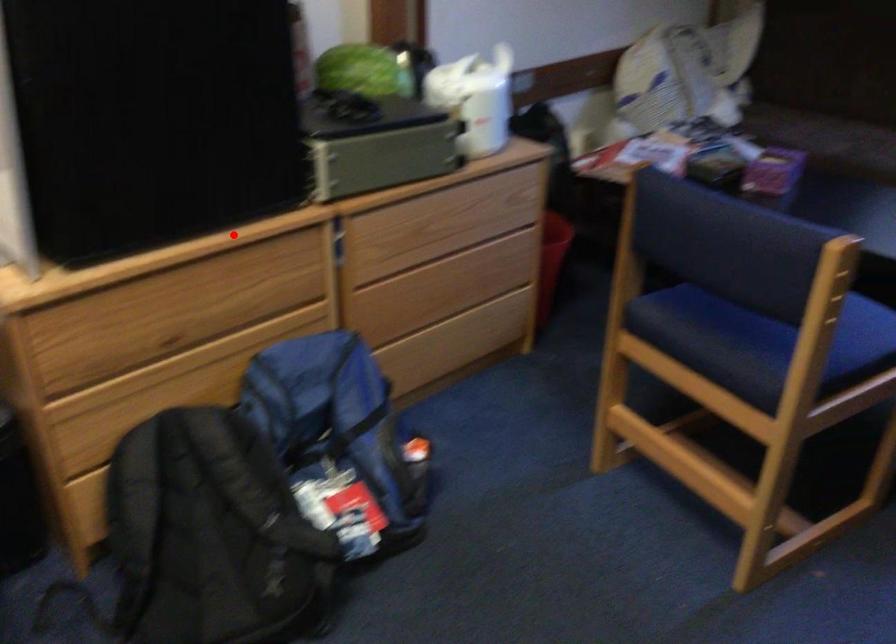
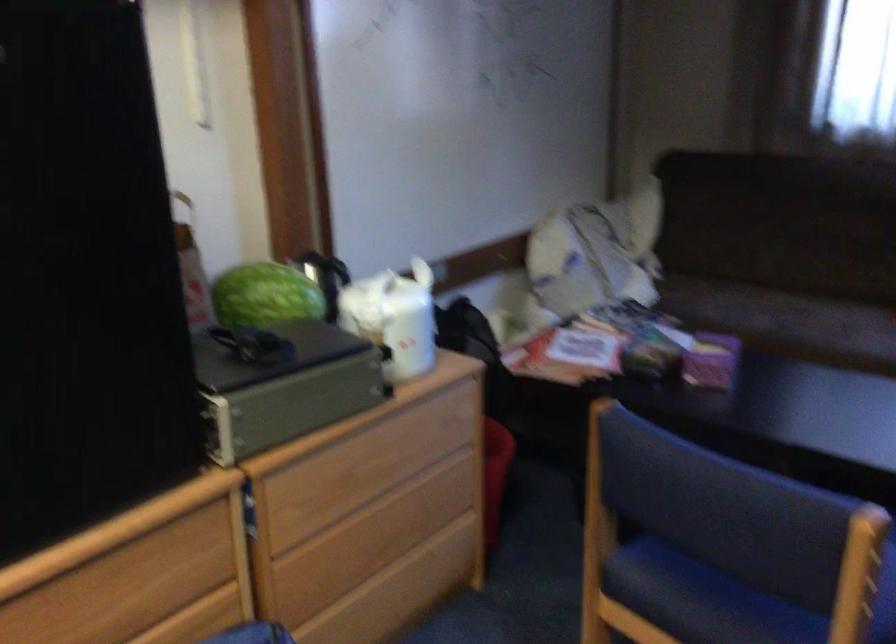
Find the pixel in the second image that matches the highlighted location in the first image.

(116, 531)